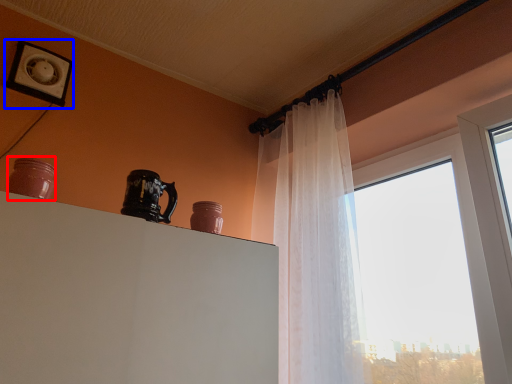
Question: Which object appears closest to the camera in this image, pottery (highlighted by a red box) or picture frame (highlighted by a blue box)?

Choices:
 (A) pottery
 (B) picture frame

Answer: (A)